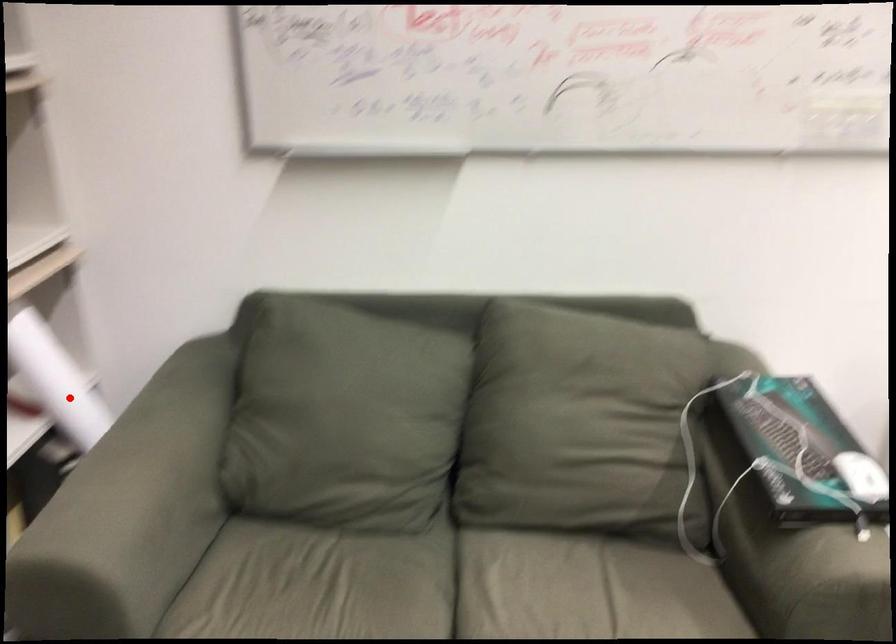
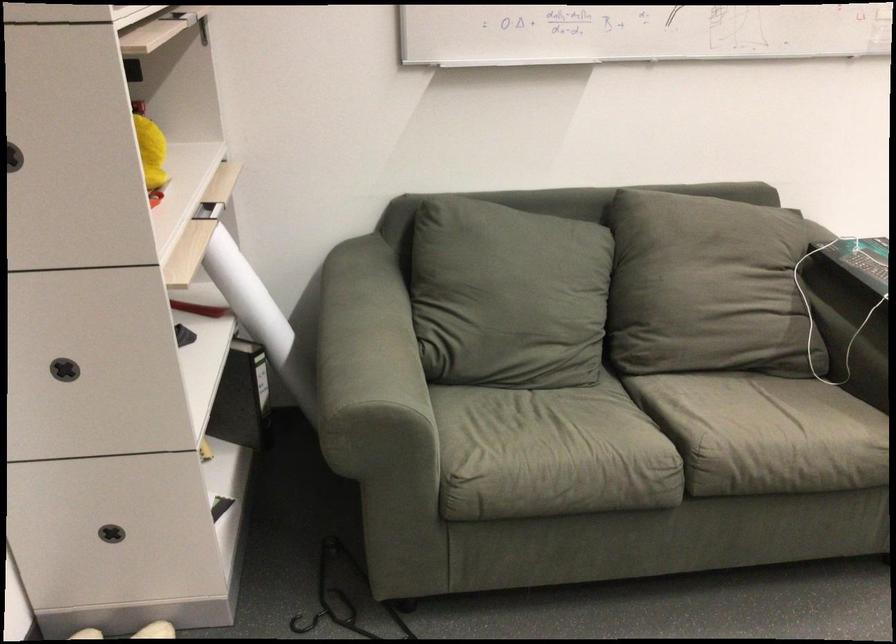
Where in the second image is the point corresponding to the highlighted location from the first image?

(247, 296)